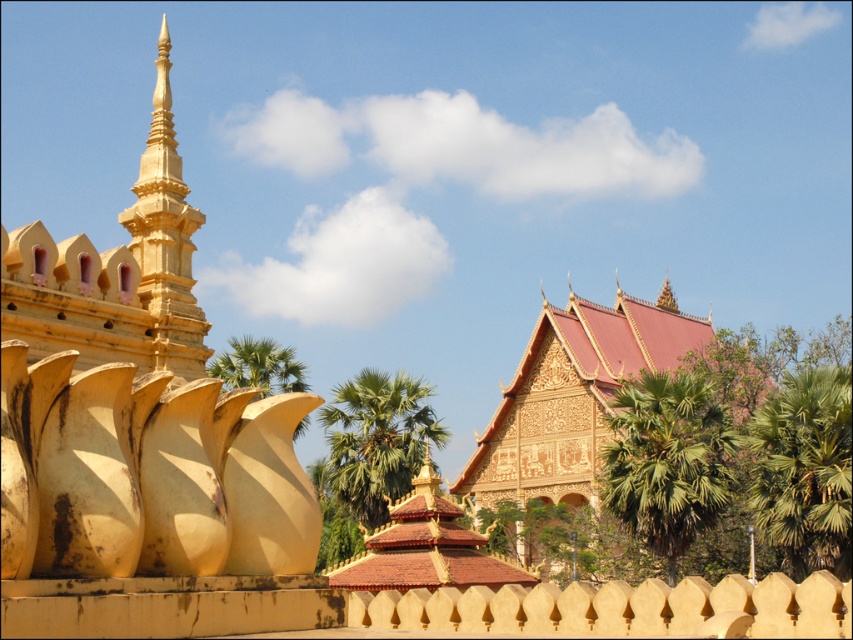
Question: Is matte gold fence at center bigger than green leafy palm tree at center?

Choices:
 (A) no
 (B) yes

Answer: (A)

Question: Does green leafy palm tree at center have a greater width compared to green leafy palm at center?

Choices:
 (A) yes
 (B) no

Answer: (B)

Question: Which object is farther from the camera taking this photo?

Choices:
 (A) golden carved temple at center
 (B) green leafy palm tree at right

Answer: (A)

Question: Considering the real-world distances, which object is closest to the gold textured spire at upper center?

Choices:
 (A) matte gold fence at center
 (B) green leafy palm at center
 (C) green leafy palm tree at center
 (D) golden carved temple at center

Answer: (D)

Question: Is green leafy palm tree at center above gold textured spire at upper center?

Choices:
 (A) no
 (B) yes

Answer: (A)

Question: Estimate the real-world distances between objects in this image. Which object is closer to the green leafy palm tree at center-right?

Choices:
 (A) green leafy palm tree at center
 (B) gold textured spire at upper center
 (C) matte gold fence at center
 (D) golden carved temple at center

Answer: (D)